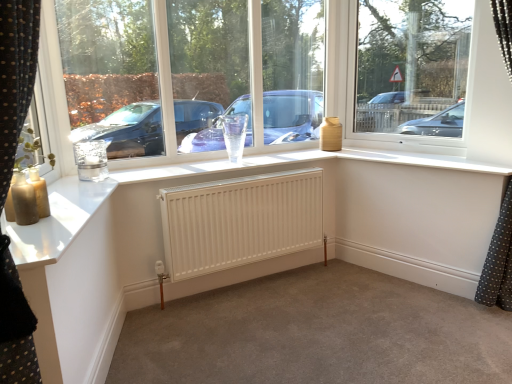
The image size is (512, 384). In order to click on space that is in front of white matte radiator at center in this screenshot , I will do `click(258, 332)`.